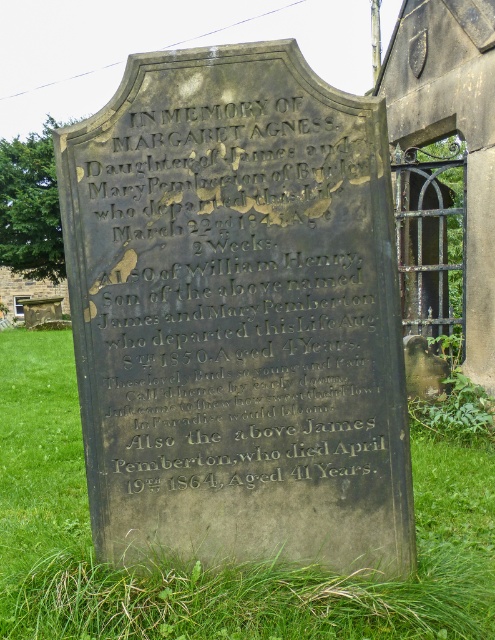
You are standing in front of the gravestone and want to place a bouquet of flowers on the green grass at lower center. Is the black stone inscription at center in the way?

The black stone inscription at center is positioned over the green grass at lower center, so placing the bouquet there might be obstructed by the inscription.

From the picture: What is the exact location of the black stone inscription at center on the gravestone?

The black stone inscription at center is located at point (238, 291).